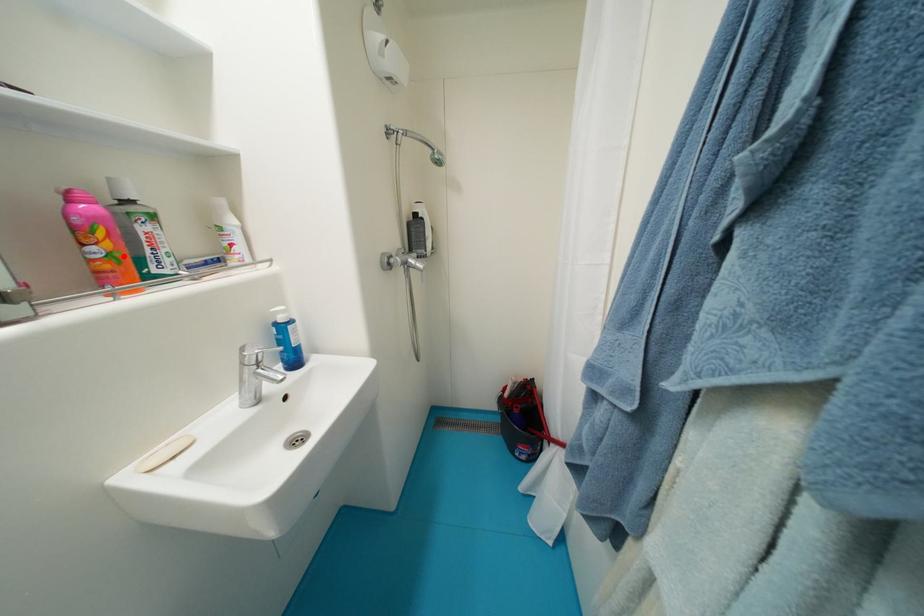
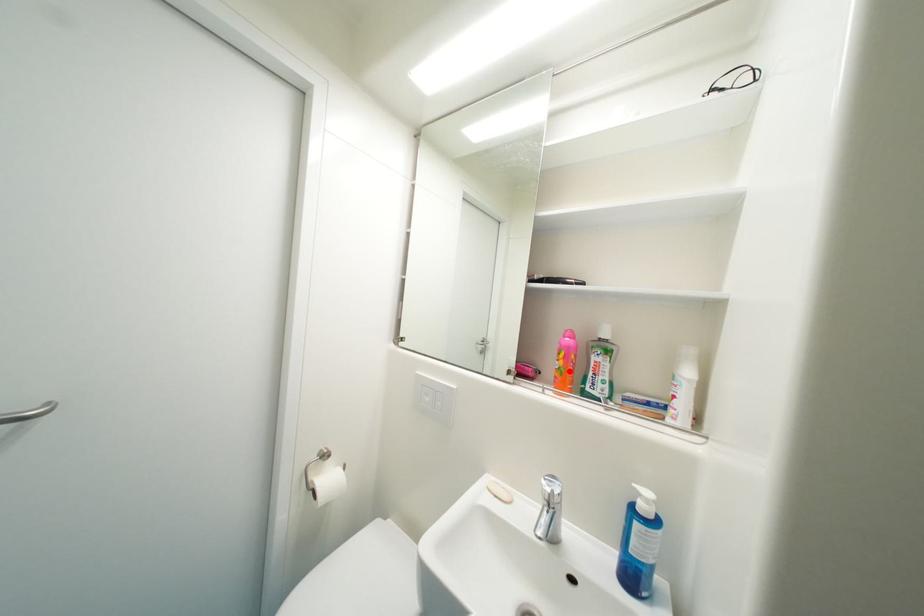
I am providing you with two images of the same scene from different viewpoints. A red point is marked on the first image and another point is marked on the second image. Does the point marked in image1 correspond to the same location as the one in image2?

Yes